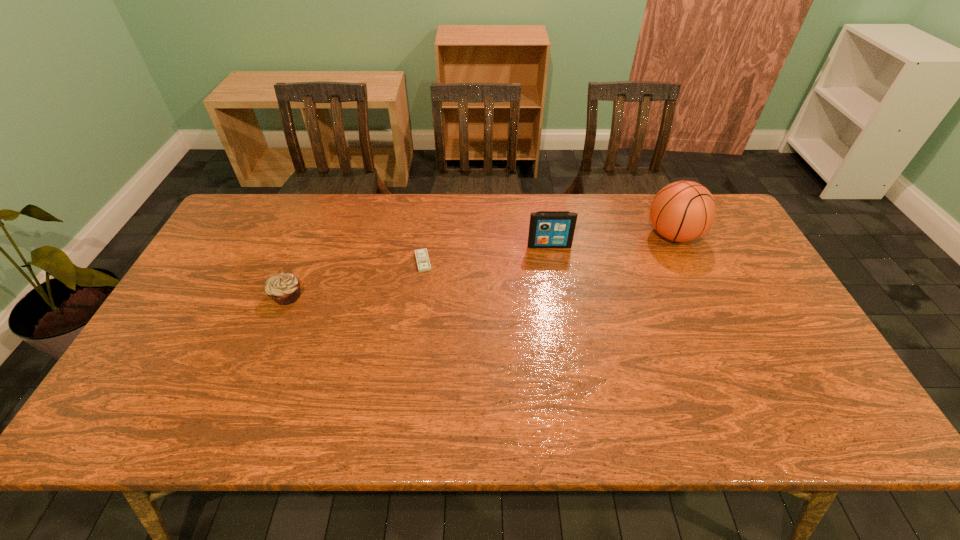
Find the location of `basketball`. basketball is located at coordinates (682, 211).

Where is `the tallest object`? Image resolution: width=960 pixels, height=540 pixels. the tallest object is located at coordinates (682, 211).

Find the location of `the third shortest object`. the third shortest object is located at coordinates (548, 229).

Find the location of a particular element. This screenshot has width=960, height=540. iPod is located at coordinates (548, 229).

This screenshot has height=540, width=960. Find the location of `the leftmost object`. the leftmost object is located at coordinates (284, 289).

Locate an element on the screen. The height and width of the screenshot is (540, 960). the second shortest object is located at coordinates (284, 289).

Locate an element on the screen. The image size is (960, 540). money is located at coordinates (422, 258).

This screenshot has height=540, width=960. In order to click on the shortest object in this screenshot , I will do `click(422, 258)`.

At what (x,y) coordinates should I click in order to perform the action: click on free space located on the left of the rightmost object. Please return your answer as a coordinate pair (x, y). The height and width of the screenshot is (540, 960). Looking at the image, I should click on (571, 235).

Identify the location of vacant position located on the front screen of the second object from right to left. [562, 321].